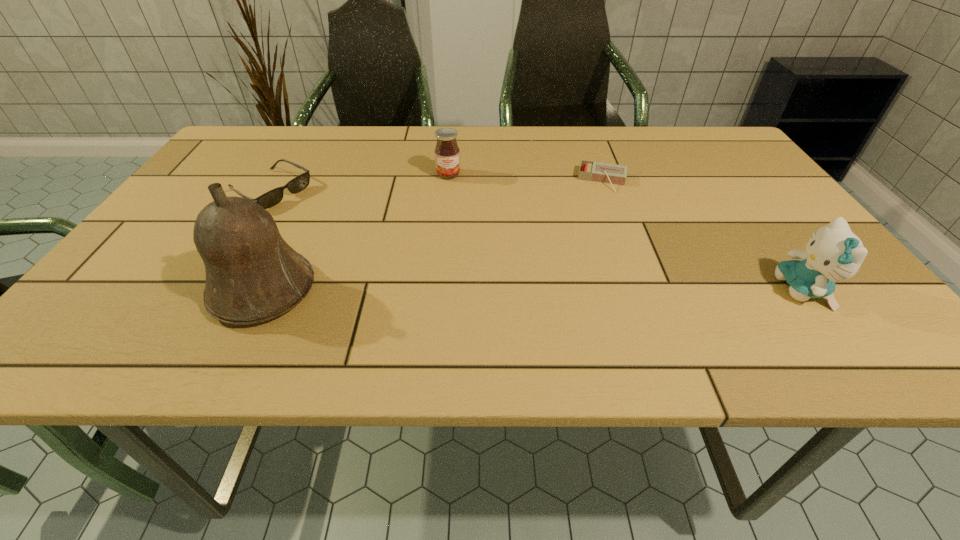
Locate an element on the screen. vacant space located on the front-facing side of the second shortest object is located at coordinates (338, 226).

Find the location of a particular element. This screenshot has width=960, height=540. bell positioned at the near edge is located at coordinates (252, 275).

At what (x,y) coordinates should I click in order to perform the action: click on kitten located at the near edge. Please return your answer as a coordinate pair (x, y). Looking at the image, I should click on (834, 253).

Locate an element on the screen. This screenshot has height=540, width=960. object situated at the left edge is located at coordinates (271, 198).

You are a GUI agent. You are given a task and a screenshot of the screen. Output one action in this format:
    pyautogui.click(x=<x>, y=<y>)
    Task: Click on the object positioned at the right edge
    Image resolution: width=960 pixels, height=540 pixels.
    Given the screenshot: What is the action you would take?
    pyautogui.click(x=834, y=253)

At what (x,y) coordinates should I click in order to perform the action: click on object positioned at the near right corner. Please return your answer as a coordinate pair (x, y). Looking at the image, I should click on (834, 253).

The height and width of the screenshot is (540, 960). In order to click on vacant space at the far edge in this screenshot , I will do `click(320, 153)`.

Image resolution: width=960 pixels, height=540 pixels. In the image, there is a desktop. Find the location of `free space at the near edge`. free space at the near edge is located at coordinates (406, 292).

This screenshot has height=540, width=960. In the image, there is a desktop. In order to click on vacant region at the far left corner in this screenshot , I will do `click(280, 136)`.

At what (x,y) coordinates should I click in order to perform the action: click on vacant space at the far right corner of the desktop. Please return your answer as a coordinate pair (x, y). This screenshot has width=960, height=540. Looking at the image, I should click on (708, 150).